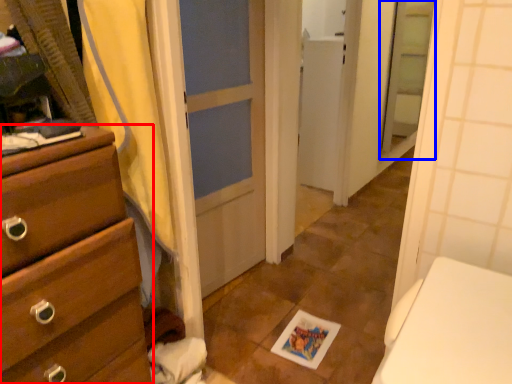
Question: Which object appears farthest to the camera in this image, chest of drawers (highlighted by a red box) or screen door (highlighted by a blue box)?

Choices:
 (A) chest of drawers
 (B) screen door

Answer: (B)